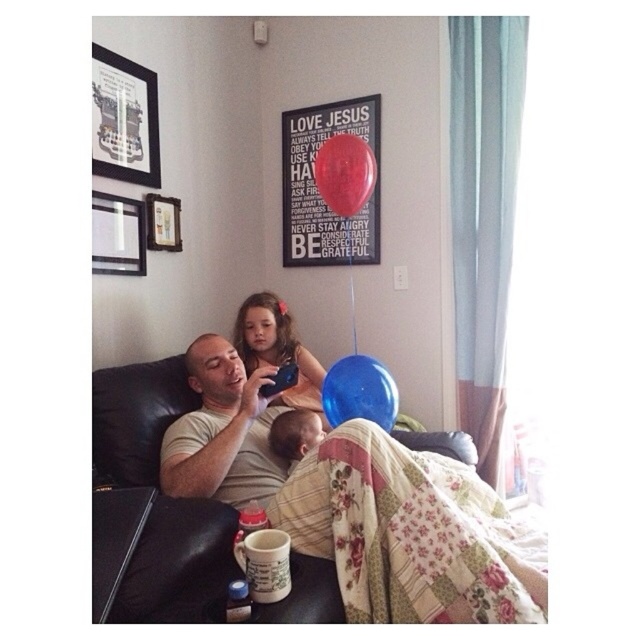
Question: Is matte black picture frame at upper left closer to the viewer compared to blue rubber balloon at center?

Choices:
 (A) no
 (B) yes

Answer: (A)

Question: Does blue rubber balloon at center have a greater width compared to metallic silver picture frame at upper left?

Choices:
 (A) no
 (B) yes

Answer: (B)

Question: Which point appears closest to the camera in this image?

Choices:
 (A) (230, 465)
 (B) (166, 237)
 (C) (115, 216)
 (D) (148, 132)

Answer: (A)

Question: Estimate the real-world distances between objects in this image. Which object is farther from the matte pink dress at center?

Choices:
 (A) shiny red balloon at upper center
 (B) smooth skin baby at center
 (C) matte black picture frame at upper left

Answer: (C)

Question: Based on their relative distances, which object is nearer to the matte black picture frame at upper left?

Choices:
 (A) smooth skin baby at center
 (B) wooden picture frame at upper left
 (C) shiny red balloon at upper center
 (D) matte pink dress at center

Answer: (B)

Question: Is matte white t-shirt at center to the right of shiny red balloon at upper center from the viewer's perspective?

Choices:
 (A) yes
 (B) no

Answer: (B)